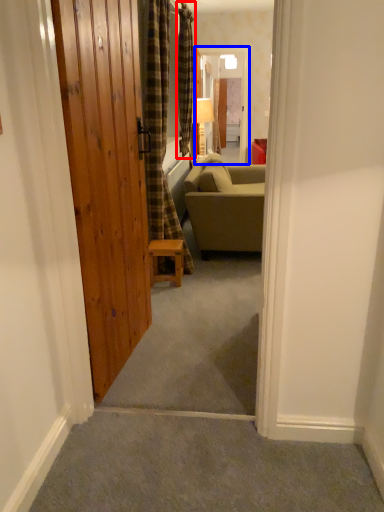
Question: Which point is further to the camera, curtain (highlighted by a red box) or screen door (highlighted by a blue box)?

Choices:
 (A) curtain
 (B) screen door

Answer: (B)